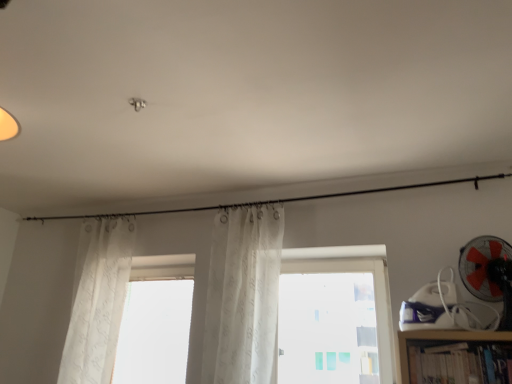
Image resolution: width=512 pixels, height=384 pixels. What do you see at coordinates (243, 296) in the screenshot?
I see `white sheer curtain at center, the first curtain when ordered from right to left` at bounding box center [243, 296].

This screenshot has height=384, width=512. In order to click on red plastic fan at right in this screenshot , I will do `click(489, 273)`.

The width and height of the screenshot is (512, 384). Find the location of `mechanical fan that is above the transparent glass window at center (from a real-world perspective)`. mechanical fan that is above the transparent glass window at center (from a real-world perspective) is located at coordinates 489,273.

Based on the photo, measure the distance from transparent glass window at center to red plastic fan at right.

25.93 inches.

Considering the positions of point (374, 261) and point (487, 260), is point (374, 261) closer or farther from the camera than point (487, 260)?

Clearly, point (374, 261) is more distant from the camera than point (487, 260).

In the image, is transparent glass window at center positioned in front of or behind red plastic fan at right?

Visually, transparent glass window at center is located behind red plastic fan at right.

How different are the orientations of transparent glass window at center and translucent white curtain at left, which is counted as the first curtain, starting from the left, in degrees?

They differ by 1.53 degrees in their facing directions.

Is transparent glass window at center looking in the opposite direction of translucent white curtain at left, which is counted as the first curtain, starting from the left?

No, transparent glass window at center's orientation is not away from translucent white curtain at left, which is counted as the first curtain, starting from the left.

Would you say transparent glass window at center is to the left or to the right of translucent white curtain at left, which is counted as the first curtain, starting from the left, in the picture?

From the image, it's evident that transparent glass window at center is to the right of translucent white curtain at left, which is counted as the first curtain, starting from the left.

Does transparent glass window at center have a lesser height compared to translucent white curtain at left, positioned as the second curtain in right-to-left order?

Yes, transparent glass window at center is shorter than translucent white curtain at left, positioned as the second curtain in right-to-left order.

Where is `curtain behind the white sheer curtain at center, the first curtain when ordered from right to left`? This screenshot has height=384, width=512. curtain behind the white sheer curtain at center, the first curtain when ordered from right to left is located at coordinates (98, 300).

Measure the distance from translucent white curtain at left, positioned as the second curtain in right-to-left order, to white sheer curtain at center, which is the 2th curtain from left to right.

34.67 inches.

Does translucent white curtain at left, positioned as the second curtain in right-to-left order, have a greater height compared to white sheer curtain at center, the first curtain when ordered from right to left?

Yes, translucent white curtain at left, positioned as the second curtain in right-to-left order, is taller than white sheer curtain at center, the first curtain when ordered from right to left.

From a real-world perspective, between translucent white curtain at left, positioned as the second curtain in right-to-left order, and hardcover book at lower right, who is vertically higher?

translucent white curtain at left, positioned as the second curtain in right-to-left order, from a real-world perspective.

Can you confirm if translucent white curtain at left, positioned as the second curtain in right-to-left order, is taller than hardcover book at lower right?

Indeed, translucent white curtain at left, positioned as the second curtain in right-to-left order, has a greater height compared to hardcover book at lower right.

In terms of size, does translucent white curtain at left, positioned as the second curtain in right-to-left order, appear bigger or smaller than hardcover book at lower right?

translucent white curtain at left, positioned as the second curtain in right-to-left order, is bigger than hardcover book at lower right.

Looking at this image, how many degrees apart are the facing directions of translucent white curtain at left, which is counted as the first curtain, starting from the left, and hardcover book at lower right?

There is a 2.97-degree angle between the facing directions of translucent white curtain at left, which is counted as the first curtain, starting from the left, and hardcover book at lower right.

Locate an element on the screen. The image size is (512, 384). mechanical fan on the right of white sheer curtain at center, which is the 2th curtain from left to right is located at coordinates (489, 273).

Which of these two, red plastic fan at right or white sheer curtain at center, the first curtain when ordered from right to left, is thinner?

white sheer curtain at center, the first curtain when ordered from right to left, is thinner.

Which of these two, red plastic fan at right or white sheer curtain at center, which is the 2th curtain from left to right, is smaller?

red plastic fan at right is smaller.

Is translucent white curtain at left, which is counted as the first curtain, starting from the left, smaller than transparent glass window at center?

Yes.

Could you tell me if translucent white curtain at left, positioned as the second curtain in right-to-left order, is facing transparent glass window at center?

No, translucent white curtain at left, positioned as the second curtain in right-to-left order, is not oriented towards transparent glass window at center.

Is translucent white curtain at left, positioned as the second curtain in right-to-left order, touching transparent glass window at center?

No, translucent white curtain at left, positioned as the second curtain in right-to-left order, is not beside transparent glass window at center.

Is translucent white curtain at left, positioned as the second curtain in right-to-left order, not within transparent glass window at center?

That's correct, translucent white curtain at left, positioned as the second curtain in right-to-left order, is outside of transparent glass window at center.

Who is shorter, hardcover book at lower right or red plastic fan at right?

Standing shorter between the two is hardcover book at lower right.

Can you see hardcover book at lower right touching red plastic fan at right?

No, hardcover book at lower right is not touching red plastic fan at right.

From a real-world perspective, which object rests below the other?

hardcover book at lower right is physically lower.

Considering the relative sizes of hardcover book at lower right and red plastic fan at right in the image provided, is hardcover book at lower right smaller than red plastic fan at right?

Yes.

This screenshot has height=384, width=512. In the image, there is a red plastic fan at right. In order to click on window below it (from a real-world perspective) in this screenshot , I will do `click(355, 271)`.

Locate an element on the screen. The width and height of the screenshot is (512, 384). the 2nd curtain behind when counting from the transparent glass window at center is located at coordinates click(98, 300).

Which object lies nearer to the anchor point hardcover book at lower right, translucent white curtain at left, positioned as the second curtain in right-to-left order, or white sheer curtain at center, which is the 2th curtain from left to right?

white sheer curtain at center, which is the 2th curtain from left to right, lies closer to hardcover book at lower right than the other object.

When comparing their distances from hardcover book at lower right, does white sheer curtain at center, the first curtain when ordered from right to left, or transparent glass window at center seem closer?

transparent glass window at center lies closer to hardcover book at lower right than the other object.

In the scene shown: When comparing their distances from transparent glass window at center, does hardcover book at lower right or white sheer curtain at center, which is the 2th curtain from left to right, seem closer?

Among the two, white sheer curtain at center, which is the 2th curtain from left to right, is located nearer to transparent glass window at center.

Looking at the image, which one is located closer to white sheer curtain at center, which is the 2th curtain from left to right, transparent glass window at center or translucent white curtain at left, positioned as the second curtain in right-to-left order?

transparent glass window at center is positioned closer to the anchor white sheer curtain at center, which is the 2th curtain from left to right.

Based on their spatial positions, is red plastic fan at right or white sheer curtain at center, the first curtain when ordered from right to left, further from hardcover book at lower right?

white sheer curtain at center, the first curtain when ordered from right to left, is further to hardcover book at lower right.

From the image, which object appears to be nearer to transparent glass window at center, translucent white curtain at left, positioned as the second curtain in right-to-left order, or white sheer curtain at center, which is the 2th curtain from left to right?

white sheer curtain at center, which is the 2th curtain from left to right, lies closer to transparent glass window at center than the other object.

Estimate the real-world distances between objects in this image. Which object is further from translucent white curtain at left, which is counted as the first curtain, starting from the left, red plastic fan at right or transparent glass window at center?

Based on the image, red plastic fan at right appears to be further to translucent white curtain at left, which is counted as the first curtain, starting from the left.

Estimate the real-world distances between objects in this image. Which object is further from transparent glass window at center, hardcover book at lower right or translucent white curtain at left, positioned as the second curtain in right-to-left order?

translucent white curtain at left, positioned as the second curtain in right-to-left order.

Find the location of a particular element. Image resolution: width=512 pixels, height=384 pixels. window between white sheer curtain at center, which is the 2th curtain from left to right, and red plastic fan at right is located at coordinates (355, 271).

Identify the location of curtain situated between translucent white curtain at left, positioned as the second curtain in right-to-left order, and red plastic fan at right from left to right. This screenshot has height=384, width=512. (243, 296).

The height and width of the screenshot is (384, 512). In order to click on book between transparent glass window at center and red plastic fan at right in the horizontal direction in this screenshot , I will do `click(461, 364)`.

This screenshot has height=384, width=512. I want to click on curtain between translucent white curtain at left, which is counted as the first curtain, starting from the left, and transparent glass window at center from left to right, so click(x=243, y=296).